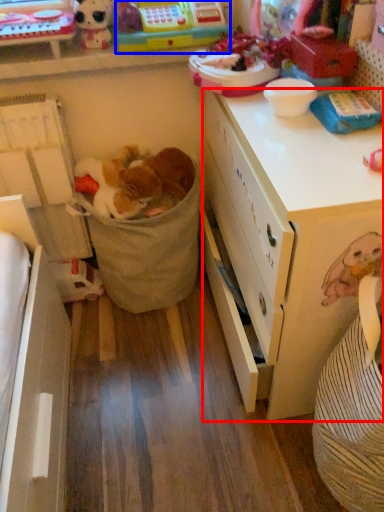
Question: Which point is closer to the camera, desk (highlighted by a red box) or toy (highlighted by a blue box)?

Choices:
 (A) desk
 (B) toy

Answer: (A)